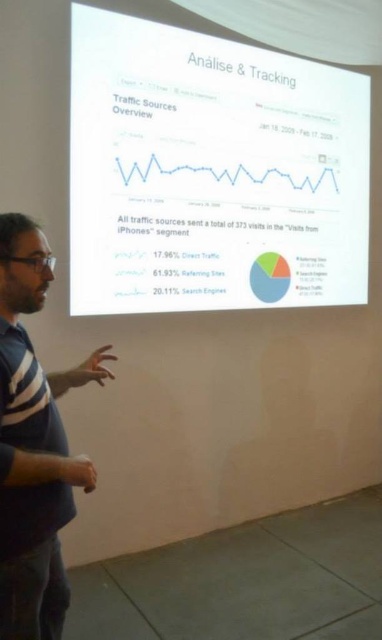
You are an attendee at the presentation and need to take a photo of the striped cotton shirt at left and the white glossy projector screen at upper center. Which object should you focus on first if you want to capture both in one shot without moving your camera?

The white glossy projector screen at upper center should be focused on first because it is larger in size compared to the striped cotton shirt at left, making it easier to ensure both are in frame without moving the camera.

You are an attendee sitting in the back row of the conference room. You want to take a photo of the striped cotton shirt at left and the white glossy projector screen at upper center to share on social media. However, your phone can only focus on one object at a time. Which object should you focus on to ensure both are visible in the photo?

You should focus on the white glossy projector screen at upper center because its width is larger than the striped cotton shirt at left, making it easier to capture both objects in the frame.

You are standing in the conference room and want to ensure that the white glossy projector screen at upper center is positioned correctly for all attendees to see. Based on its 2D coordinates, can you determine if it is centered horizontally in the room?

The white glossy projector screen at upper center is located at coordinates point (212, 172), so it is not centered horizontally since the horizontal coordinate 0.269 is less than 0.5, which would be the center point.